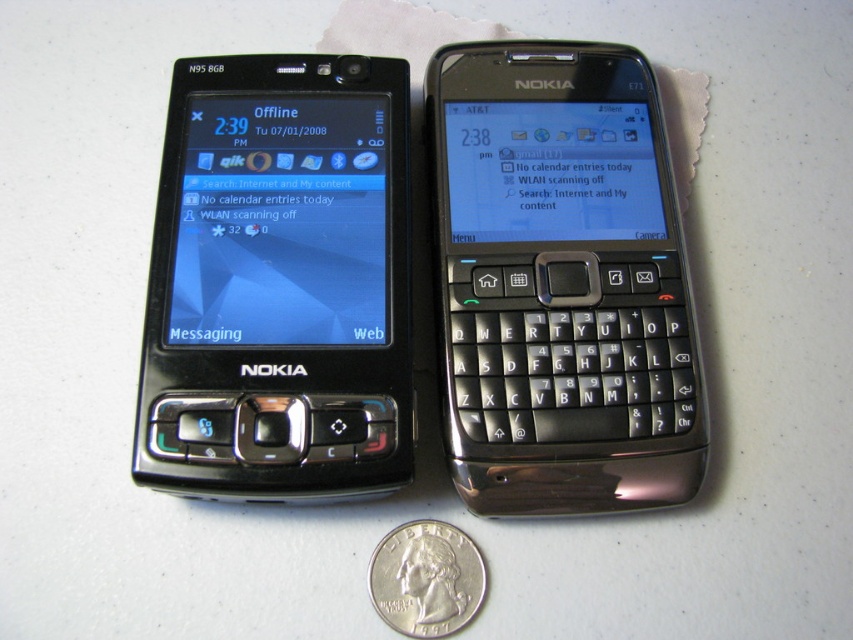
You are organizing a display of vintage electronics and need to arrange the satin black phone at center and the matte black phone at left according to their positions in the image. Which phone should be placed higher up on the shelf?

The satin black phone at center should be placed higher up on the shelf since it is located above the matte black phone at left in the image.

You are a delivery drone that needs to fly from the point at coordinates (x=532, y=422) to the point at coordinates (x=415, y=602). According to the scene, will you have to fly over any objects between these two points?

Point (x=532, y=422) is behind point (x=415, y=602), so the drone will not have to fly over any objects between them because the starting point is already behind the destination point.

You are holding a small toy car that you want to place on the white surface between the satin black phone at center and the silver metallic quarter at lower center. Based on their positions, can the toy car be placed in front of both objects?

The silver metallic quarter at lower center is behind the satin black phone at center, so placing the toy car in front of both would require positioning it in front of the satin black phone at center. However, since the quarter is already behind the phone, the toy car can be placed in front of the satin black phone at center, effectively being in front of both objects if positioned correctly.